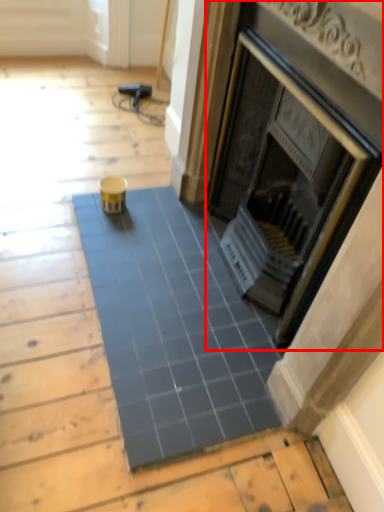
Question: From the image's perspective, what is the correct spatial relationship of fireplace (annotated by the red box) in relation to ceramic tile?

Choices:
 (A) below
 (B) above

Answer: (B)